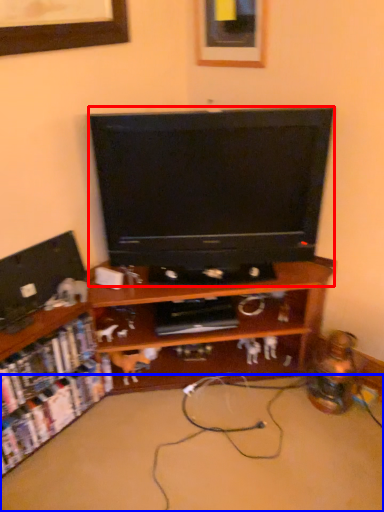
Question: Which object is further to the camera taking this photo, television (highlighted by a red box) or plain (highlighted by a blue box)?

Choices:
 (A) television
 (B) plain

Answer: (A)